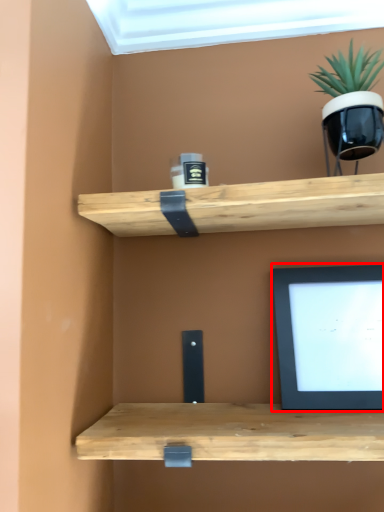
Question: From the image's perspective, where is computer monitor (annotated by the red box) located in relation to houseplant in the image?

Choices:
 (A) below
 (B) above

Answer: (A)